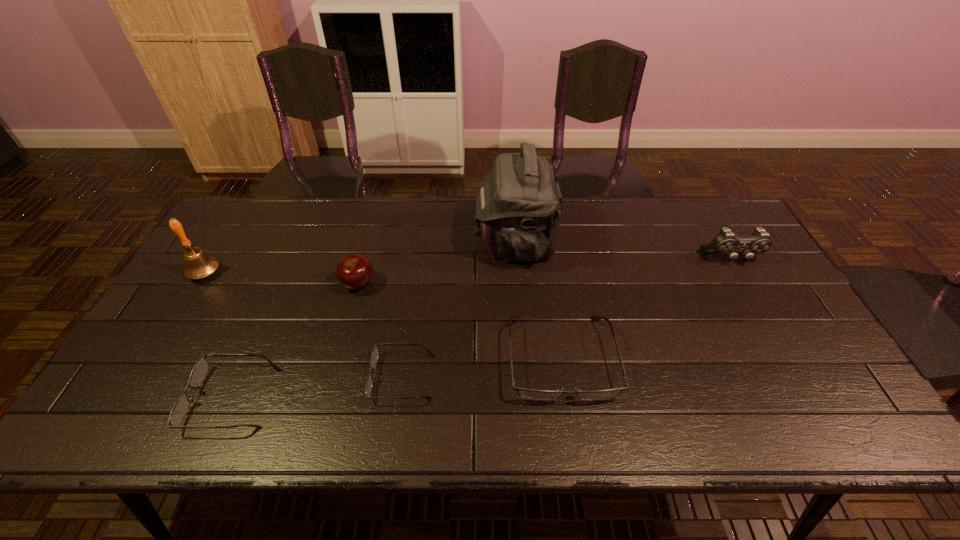
This screenshot has height=540, width=960. I want to click on the leftmost spectacles, so click(x=180, y=409).

The height and width of the screenshot is (540, 960). What are the coordinates of `the sixth object from right to left` in the screenshot? It's located at (180, 409).

Find the location of `the shortest spectacles`. the shortest spectacles is located at coordinates (374, 357).

Where is `the fourth object from right to left`? the fourth object from right to left is located at coordinates (374, 357).

The image size is (960, 540). I want to click on the tallest spectacles, so click(533, 394).

This screenshot has height=540, width=960. What are the coordinates of `the rightmost spectacles` in the screenshot? It's located at (533, 394).

Identify the location of the tallest object. (519, 207).

Where is `the rightmost object`? This screenshot has height=540, width=960. the rightmost object is located at coordinates (725, 242).

What are the coordinates of `apple` in the screenshot? It's located at (354, 272).

This screenshot has width=960, height=540. I want to click on bell, so click(198, 265).